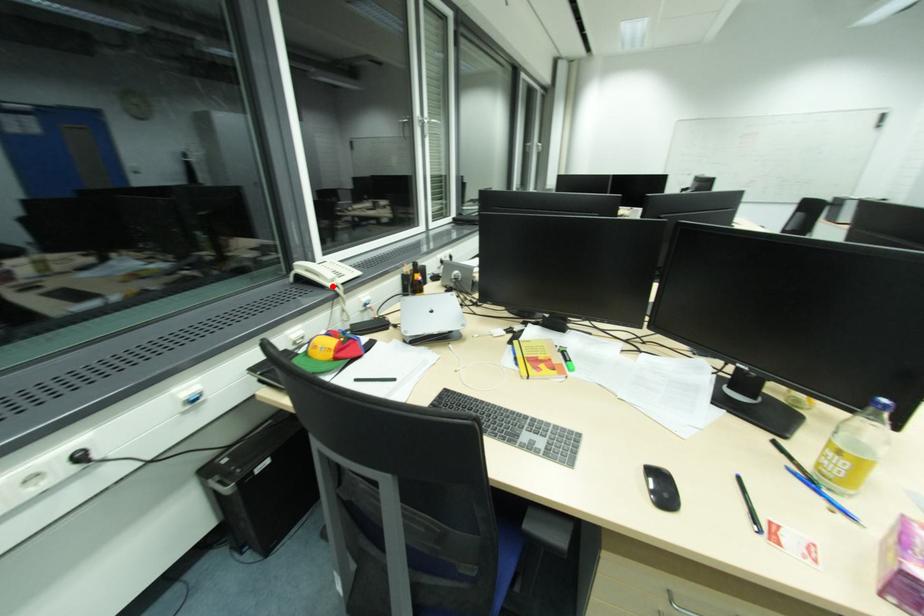
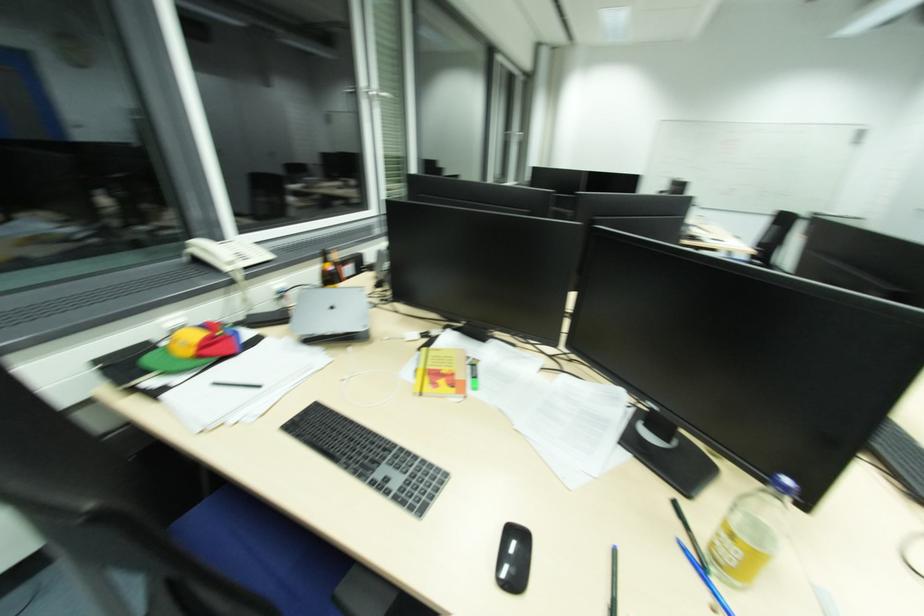
In the second image, find the point that corresponds to the highlighted location in the first image.

(231, 270)